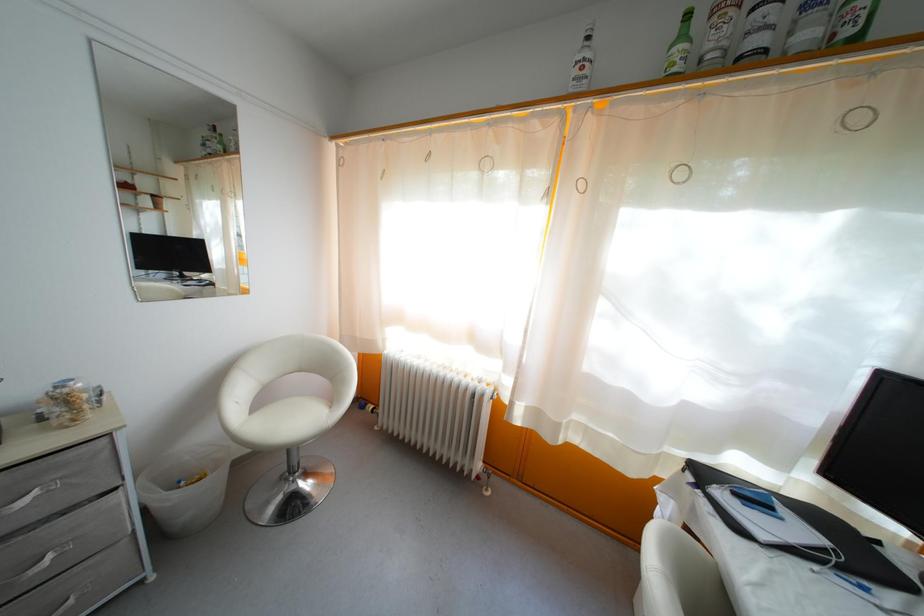
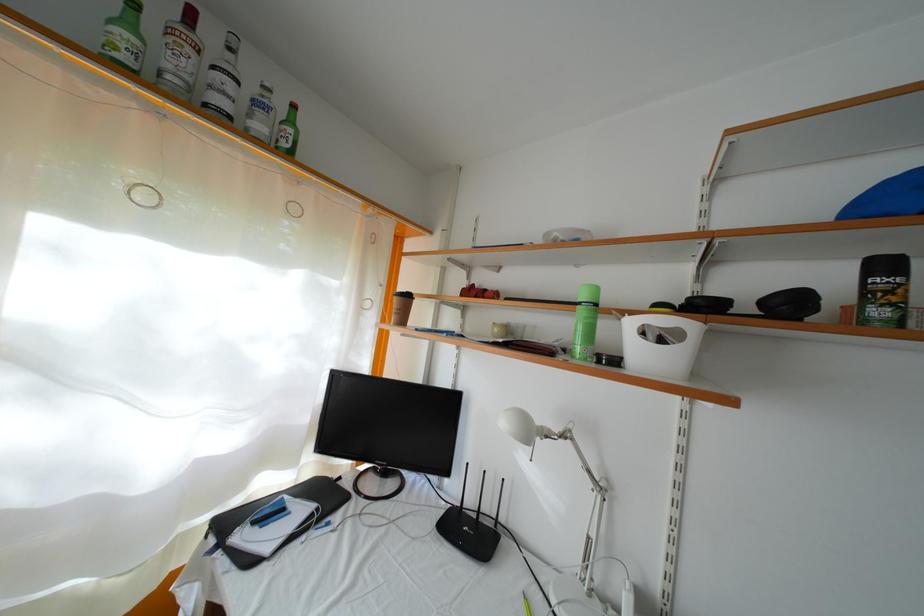
The point at (688,43) is marked in the first image. Where is the corresponding point in the second image?

(134, 31)